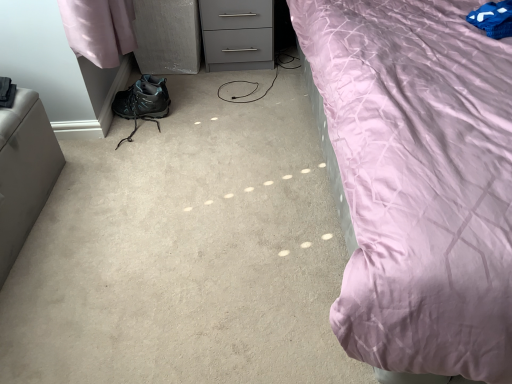
You are a GUI agent. You are given a task and a screenshot of the screen. Output one action in this format:
    pyautogui.click(x=<x>, y=<y>)
    Task: Click on the vacant space in matte black boot at lower left (from a real-world perspective)
    Image resolution: width=512 pixels, height=384 pixels.
    Given the screenshot: What is the action you would take?
    pyautogui.click(x=135, y=131)